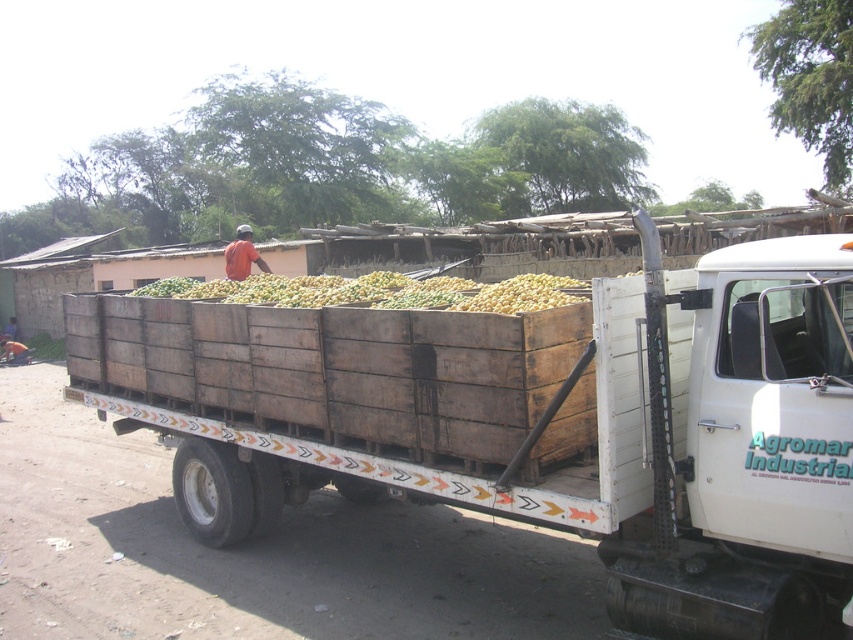
Does wooden crates at center appear on the left side of yellow matte produce at center?

Incorrect, wooden crates at center is not on the left side of yellow matte produce at center.

Between wooden crates at center and yellow matte produce at center, which one is positioned lower?

wooden crates at center is lower down.

Does point (73, 321) come closer to viewer compared to point (461, 294)?

No, it is behind (461, 294).

Identify the location of wooden crates at center. (531, 420).